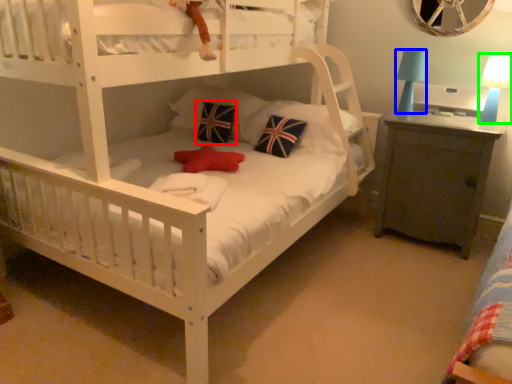
Question: Estimate the real-world distances between objects in this image. Which object is closer to pillow (highlighted by a red box), table lamp (highlighted by a blue box) or table lamp (highlighted by a green box)?

Choices:
 (A) table lamp
 (B) table lamp

Answer: (A)